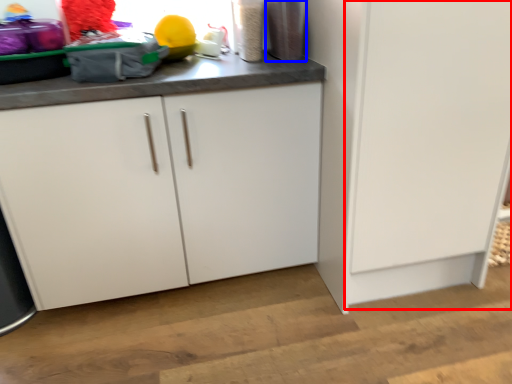
Question: Which of the following is the closest to the observer, door (highlighted by a red box) or appliance (highlighted by a blue box)?

Choices:
 (A) door
 (B) appliance

Answer: (A)